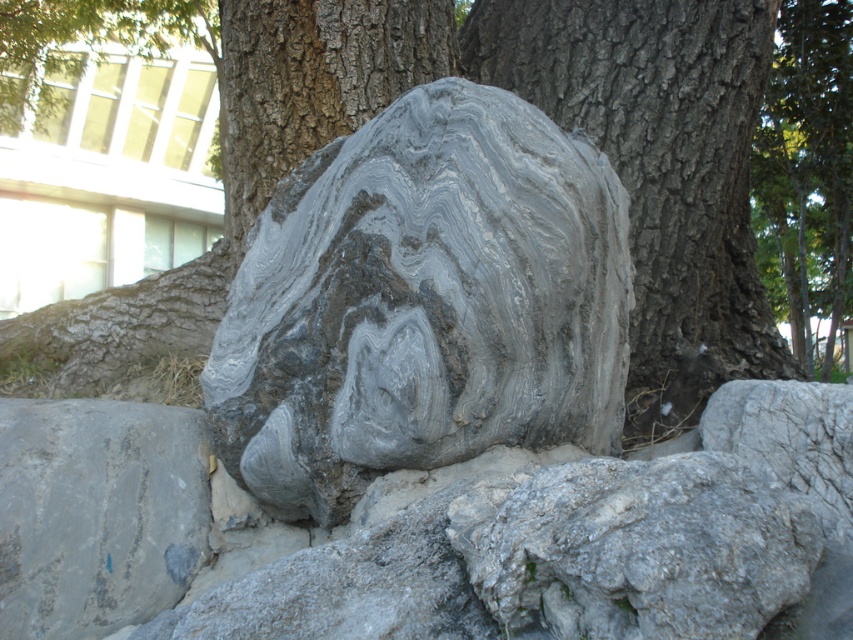
Question: Which point is closer to the camera taking this photo?

Choices:
 (A) (49, 531)
 (B) (558, 472)

Answer: (B)

Question: Can you confirm if gray marble rock at center is positioned above gray rough tree trunk at center?

Choices:
 (A) yes
 (B) no

Answer: (B)

Question: Where is marble sculpture at center located in relation to gray rough rock at center in the image?

Choices:
 (A) above
 (B) below

Answer: (A)

Question: Which point appears farthest from the camera in this image?

Choices:
 (A) (743, 109)
 (B) (128, 417)

Answer: (A)

Question: From the image, what is the correct spatial relationship of gray marble rock at center in relation to marble sculpture at center?

Choices:
 (A) right
 (B) left

Answer: (B)

Question: Which point appears farthest from the camera in this image?

Choices:
 (A) (550, 44)
 (B) (628, 236)
 (C) (200, 422)

Answer: (A)